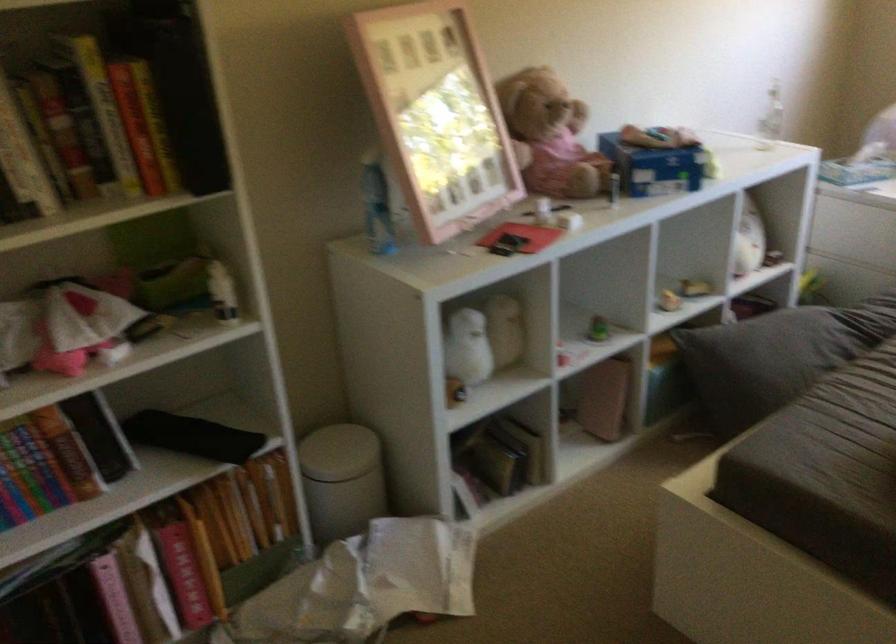
Which object does [771,114] point to?

It corresponds to the clear water bottle in the image.